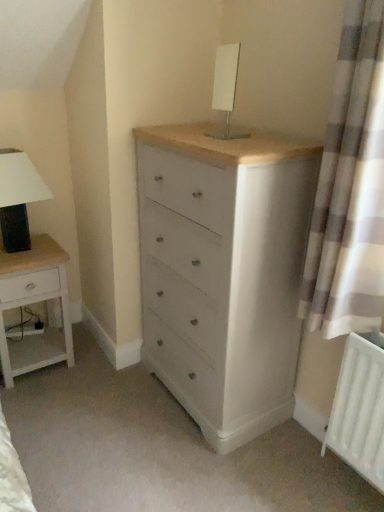
At what (x,y) coordinates should I click in order to perform the action: click on vacant space to the right of white wood nightstand at left. Please return your answer as a coordinate pair (x, y). The width and height of the screenshot is (384, 512). Looking at the image, I should click on point(96,375).